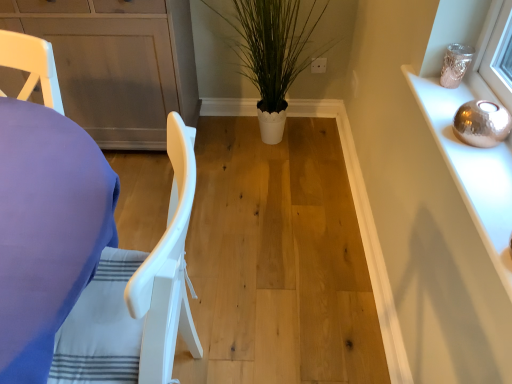
Question: Does green leafy plant at center have a greater height compared to matte gray cabinet at center, which is the second cabinetry from front to back?

Choices:
 (A) no
 (B) yes

Answer: (A)

Question: Considering the relative sizes of green leafy plant at center and matte gray cabinet at center, which is the second cabinetry from front to back, in the image provided, is green leafy plant at center shorter than matte gray cabinet at center, which is the second cabinetry from front to back,?

Choices:
 (A) no
 (B) yes

Answer: (B)

Question: Does green leafy plant at center have a larger size compared to matte gray cabinet at center, the 2th cabinetry positioned from the right?

Choices:
 (A) yes
 (B) no

Answer: (B)

Question: From a real-world perspective, does green leafy plant at center stand above matte gray cabinet at center, which is the second cabinetry from front to back?

Choices:
 (A) yes
 (B) no

Answer: (A)

Question: Does green leafy plant at center touch matte gray cabinet at center, the 2th cabinetry positioned from the right?

Choices:
 (A) no
 (B) yes

Answer: (A)

Question: Considering the relative positions of green leafy plant at center and matte gray cabinet at center, marked as the 1th cabinetry in a back-to-front arrangement, in the image provided, is green leafy plant at center to the right of matte gray cabinet at center, marked as the 1th cabinetry in a back-to-front arrangement, from the viewer's perspective?

Choices:
 (A) no
 (B) yes

Answer: (B)

Question: Is the depth of silver metallic sphere at upper right, which is counted as the second cabinetry, starting from the back, less than that of green leafy plant at center?

Choices:
 (A) no
 (B) yes

Answer: (B)

Question: Can you confirm if silver metallic sphere at upper right, the 2th cabinetry when ordered from left to right, is wider than green leafy plant at center?

Choices:
 (A) no
 (B) yes

Answer: (A)

Question: Considering the relative sizes of silver metallic sphere at upper right, which is the 1th cabinetry in front-to-back order, and green leafy plant at center in the image provided, is silver metallic sphere at upper right, which is the 1th cabinetry in front-to-back order, thinner than green leafy plant at center?

Choices:
 (A) yes
 (B) no

Answer: (A)

Question: Is silver metallic sphere at upper right, which is counted as the second cabinetry, starting from the back, in contact with green leafy plant at center?

Choices:
 (A) yes
 (B) no

Answer: (B)

Question: Considering the relative sizes of silver metallic sphere at upper right, which is the 1th cabinetry in front-to-back order, and green leafy plant at center in the image provided, is silver metallic sphere at upper right, which is the 1th cabinetry in front-to-back order, taller than green leafy plant at center?

Choices:
 (A) no
 (B) yes

Answer: (A)

Question: From the image's perspective, would you say silver metallic sphere at upper right, the first cabinetry viewed from the right, is positioned over green leafy plant at center?

Choices:
 (A) yes
 (B) no

Answer: (B)

Question: From a real-world perspective, is white plastic chair at left on green leafy plant at center?

Choices:
 (A) no
 (B) yes

Answer: (A)